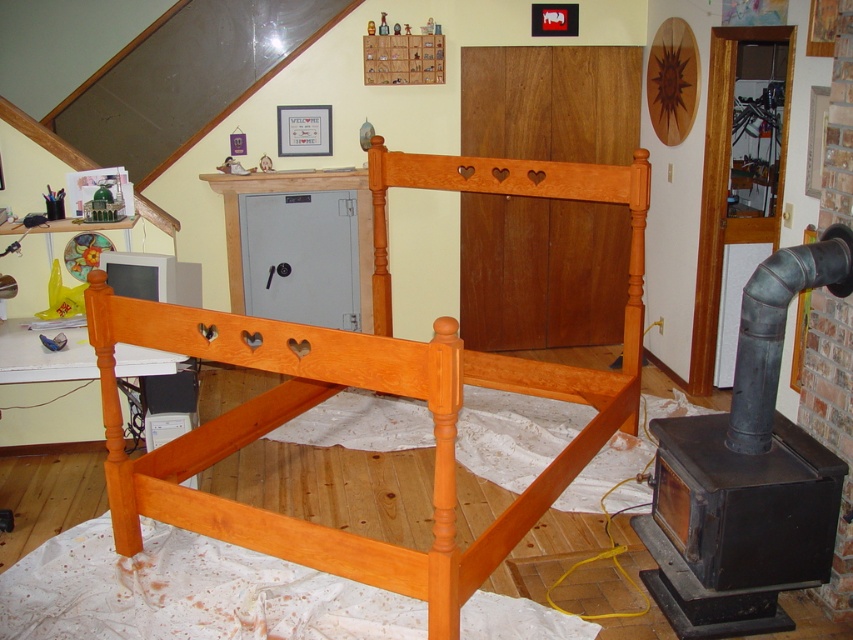
Is cherry wood bunk bed at center thinner than cherry wood headboard at center?

Incorrect, cherry wood bunk bed at center's width is not less than cherry wood headboard at center's.

How much distance is there between cherry wood bunk bed at center and cherry wood headboard at center?

cherry wood bunk bed at center and cherry wood headboard at center are 22.23 inches apart from each other.

Is point (405, 170) closer to camera compared to point (445, 173)?

That is False.

Where is `cherry wood bunk bed at center`? This screenshot has width=853, height=640. cherry wood bunk bed at center is located at coordinates (372, 388).